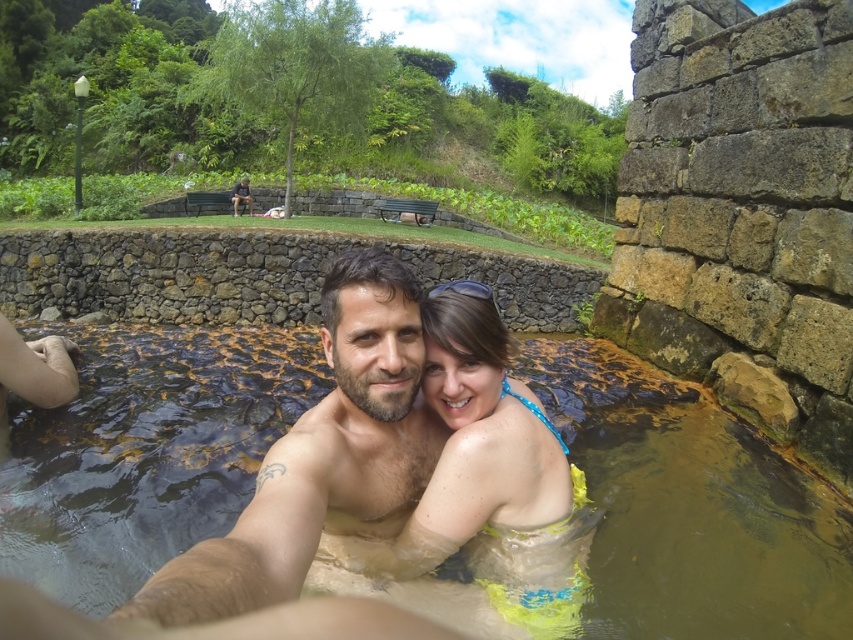
You are standing on the edge of the hot spring and want to place a floating mat on the water. The neon yellow fabric at center is already placed. Where should you place the floating mat so it stays above the brown murky water at center?

You should place the floating mat above the brown murky water at center, ensuring it stays above the neon yellow fabric at center since the brown murky water is located below it.

In the serene hot spring scene, there is a smooth skin man at center and a neon yellow fabric at center. From the perspective of someone standing at the edge of the hot spring, which object is positioned more to the left?

The smooth skin man at center is positioned to the left of the neon yellow fabric at center, so from the edge of the hot spring, the smooth skin man at center is more to the left.

You are a photographer positioned at the origin point of the scene. You want to capture a closeup shot of the smooth skin man at center. Given that your camera has a focal length of 50mm, what is the approximate distance in meters you should maintain to achieve a headshot that fills the frame?

The smooth skin man at center is positioned at point (317, 481). Using the formula for calculating distance based on focal length and subject size, the photographer should maintain a distance of approximately 1.2 meters to capture a headshot that fills the frame.